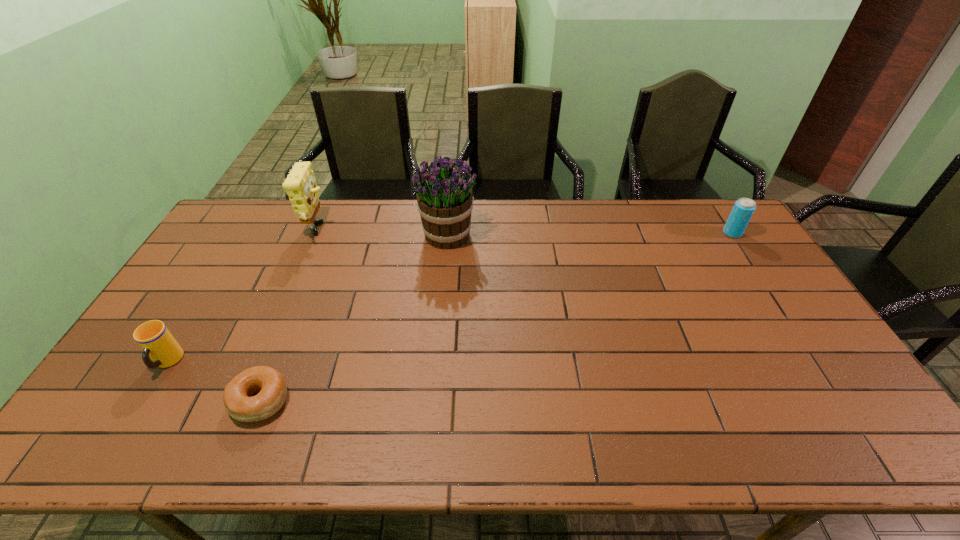
You are a GUI agent. You are given a task and a screenshot of the screen. Output one action in this format:
    pyautogui.click(x=<x>, y=<y>)
    Task: Click on the free space between the tallest object and the leftmost object
    The width and height of the screenshot is (960, 540).
    Given the screenshot: What is the action you would take?
    pyautogui.click(x=308, y=299)

Locate an element on the screen. The height and width of the screenshot is (540, 960). unoccupied position between the leftmost object and the fourth shortest object is located at coordinates (243, 297).

Where is `vacant area that lies between the shortest object and the sponge`? The width and height of the screenshot is (960, 540). vacant area that lies between the shortest object and the sponge is located at coordinates (289, 316).

Find the location of `free spot between the bouquet and the leftmost object`. free spot between the bouquet and the leftmost object is located at coordinates (308, 299).

Select which object is the third closest to the leftmost object. Please provide its 2D coordinates. Your answer should be formatted as a tuple, i.e. [(x, y)], where the tuple contains the x and y coordinates of a point satisfying the conditions above.

[(444, 195)]

Locate which object is the closest to the leftmost object. Please provide its 2D coordinates. Your answer should be formatted as a tuple, i.e. [(x, y)], where the tuple contains the x and y coordinates of a point satisfying the conditions above.

[(271, 385)]

I want to click on vacant point that satisfies the following two spatial constraints: 1. on the face of the fourth shortest object; 2. on the side of the cup with the handle, so click(x=262, y=362).

Identify the location of vacant space that satisfies the following two spatial constraints: 1. on the back side of the second object from right to left; 2. on the face of the sponge. The width and height of the screenshot is (960, 540). (448, 232).

The height and width of the screenshot is (540, 960). In order to click on vacant region that satisfies the following two spatial constraints: 1. on the back side of the soda can; 2. on the face of the fourth shortest object in this screenshot , I will do `click(732, 232)`.